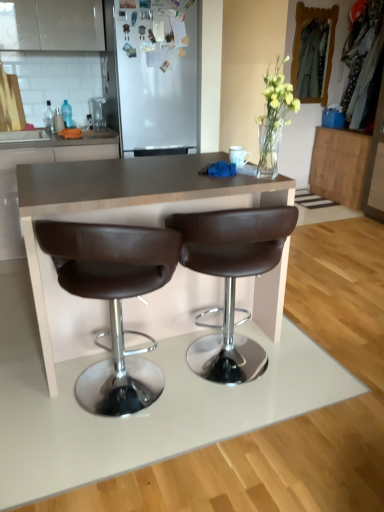
You are a GUI agent. You are given a task and a screenshot of the screen. Output one action in this format:
    pyautogui.click(x=<x>, y=<y>)
    Task: Click on the free point above brown leather table at center (from a real-world perspective)
    
    Given the screenshot: What is the action you would take?
    (137, 172)